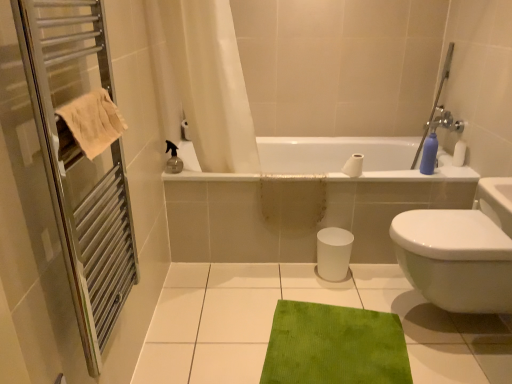
Where is `vacant space to the left of blue matte bottle at upper right`? This screenshot has height=384, width=512. vacant space to the left of blue matte bottle at upper right is located at coordinates (399, 175).